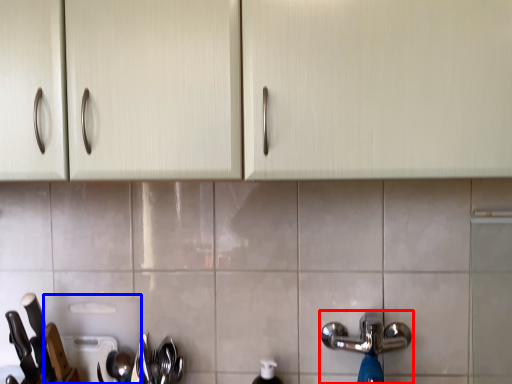
Question: Which of the following is the closest to the observer, tap (highlighted by a red box) or appliance (highlighted by a blue box)?

Choices:
 (A) tap
 (B) appliance

Answer: (A)